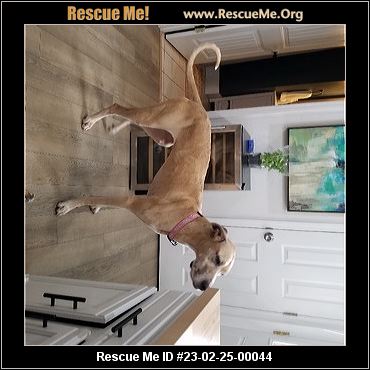
Find the location of a particular element. white wall is located at coordinates (212, 201), (262, 203), (263, 123), (329, 113).